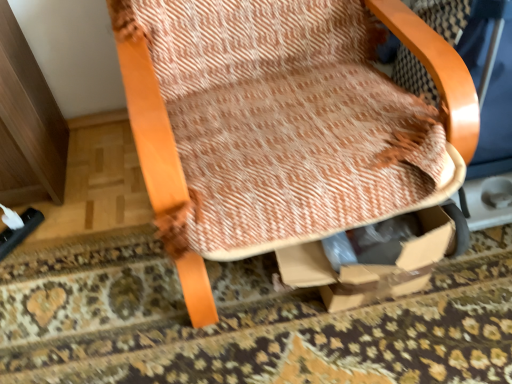
What is the approximate height of wooden textured chair at center?

wooden textured chair at center is 33.79 inches in height.

Where is `wooden textured chair at center`? This screenshot has height=384, width=512. wooden textured chair at center is located at coordinates (150, 123).

Describe the element at coordinates (150, 123) in the screenshot. I see `wooden textured chair at center` at that location.

What do you see at coordinates (249, 323) in the screenshot? The width and height of the screenshot is (512, 384). I see `textured beige rug at center` at bounding box center [249, 323].

This screenshot has height=384, width=512. Find the location of `textured beige rug at center`. textured beige rug at center is located at coordinates (249, 323).

Measure the distance between textured beige rug at center and camera.

36.60 inches.

You are a GUI agent. You are given a task and a screenshot of the screen. Output one action in this format:
    pyautogui.click(x=<x>, y=<y>)
    Task: Click on the wooden textured chair at center
    
    Given the screenshot: What is the action you would take?
    pyautogui.click(x=150, y=123)

Is wooden textured chair at center to the left or to the right of textured beige rug at center in the image?

wooden textured chair at center is to the right of textured beige rug at center.

Which object is closer to the camera taking this photo, wooden textured chair at center or textured beige rug at center?

wooden textured chair at center is in front.

Does point (183, 191) appear closer or farther from the camera than point (1, 357)?

Point (183, 191) is positioned closer to the camera compared to point (1, 357).

From the image's perspective, is wooden textured chair at center located beneath textured beige rug at center?

Actually, wooden textured chair at center appears above textured beige rug at center in the image.

From a real-world perspective, is wooden textured chair at center under textured beige rug at center?

Incorrect, from a real-world perspective, wooden textured chair at center is higher than textured beige rug at center.

Looking at their sizes, would you say wooden textured chair at center is wider or thinner than textured beige rug at center?

wooden textured chair at center is thinner than textured beige rug at center.

Is wooden textured chair at center taller than textured beige rug at center?

Yes, wooden textured chair at center is taller than textured beige rug at center.

Who is bigger, wooden textured chair at center or textured beige rug at center?

With larger size is wooden textured chair at center.

Consider the image. Is textured beige rug at center located within wooden textured chair at center?

No, textured beige rug at center is not surrounded by wooden textured chair at center.

Based on the photo, is wooden textured chair at center far away from textured beige rug at center?

No, wooden textured chair at center is in close proximity to textured beige rug at center.

Is textured beige rug at center at the back of wooden textured chair at center?

No, wooden textured chair at center's orientation is not away from textured beige rug at center.

How many degrees apart are the facing directions of wooden textured chair at center and textured beige rug at center?

The angular difference between wooden textured chair at center and textured beige rug at center is 96 degrees.

Locate an element on the screen. mat that is on the left side of wooden textured chair at center is located at coordinates (249, 323).

Is textured beige rug at center to the right of wooden textured chair at center from the viewer's perspective?

No, textured beige rug at center is not to the right of wooden textured chair at center.

Relative to wooden textured chair at center, is textured beige rug at center in front or behind?

Visually, textured beige rug at center is located behind wooden textured chair at center.

Considering the points (166, 356) and (170, 188), which point is behind, point (166, 356) or point (170, 188)?

The point (166, 356) is farther from the camera.

From the image's perspective, is textured beige rug at center on wooden textured chair at center?

No.

From a real-world perspective, is textured beige rug at center beneath wooden textured chair at center?

Correct, in the physical world, textured beige rug at center is lower than wooden textured chair at center.

Considering the sizes of objects textured beige rug at center and wooden textured chair at center in the image provided, who is thinner, textured beige rug at center or wooden textured chair at center?

With smaller width is wooden textured chair at center.

Who is shorter, textured beige rug at center or wooden textured chair at center?

Standing shorter between the two is textured beige rug at center.

Considering the sizes of objects textured beige rug at center and wooden textured chair at center in the image provided, who is bigger, textured beige rug at center or wooden textured chair at center?

Bigger between the two is wooden textured chair at center.

Is textured beige rug at center completely or partially outside of wooden textured chair at center?

Yes.

Can you see textured beige rug at center touching wooden textured chair at center?

No.

Is textured beige rug at center aimed at wooden textured chair at center?

Yes, textured beige rug at center is oriented towards wooden textured chair at center.

Image resolution: width=512 pixels, height=384 pixels. Identify the location of chair in front of the textured beige rug at center. (150, 123).

Locate an element on the screen. Image resolution: width=512 pixels, height=384 pixels. chair in front of the textured beige rug at center is located at coordinates (150, 123).

Identify the location of mat below the wooden textured chair at center (from the image's perspective). The width and height of the screenshot is (512, 384). (249, 323).